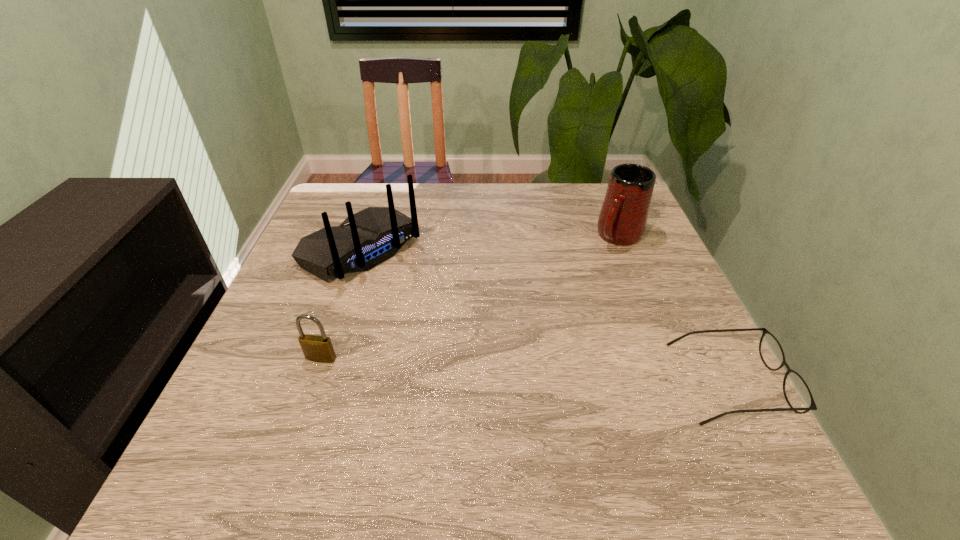
You are a GUI agent. You are given a task and a screenshot of the screen. Output one action in this format:
    pyautogui.click(x=<x>, y=<y>)
    Task: Click on the vacant space that satisfies the following two spatial constraints: 1. on the back side of the second shortest object; 2. on the right side of the router
    The height and width of the screenshot is (540, 960).
    Given the screenshot: What is the action you would take?
    pyautogui.click(x=358, y=250)

Identify the location of vacant space that satisfies the following two spatial constraints: 1. on the back side of the mug; 2. on the left side of the router. The image size is (960, 540). (366, 237).

The height and width of the screenshot is (540, 960). What are the coordinates of `free space that satisfies the following two spatial constraints: 1. on the front side of the router; 2. on the front-facing side of the spectacles` in the screenshot? It's located at (318, 382).

Locate an element on the screen. vacant space that satisfies the following two spatial constraints: 1. on the front side of the router; 2. on the front-facing side of the shortest object is located at coordinates (318, 382).